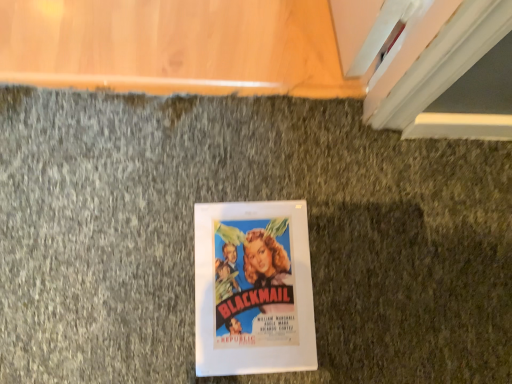
Where is `vacant space underneath matte paper poster at center (from a real-world perspective)`? vacant space underneath matte paper poster at center (from a real-world perspective) is located at coordinates (253, 281).